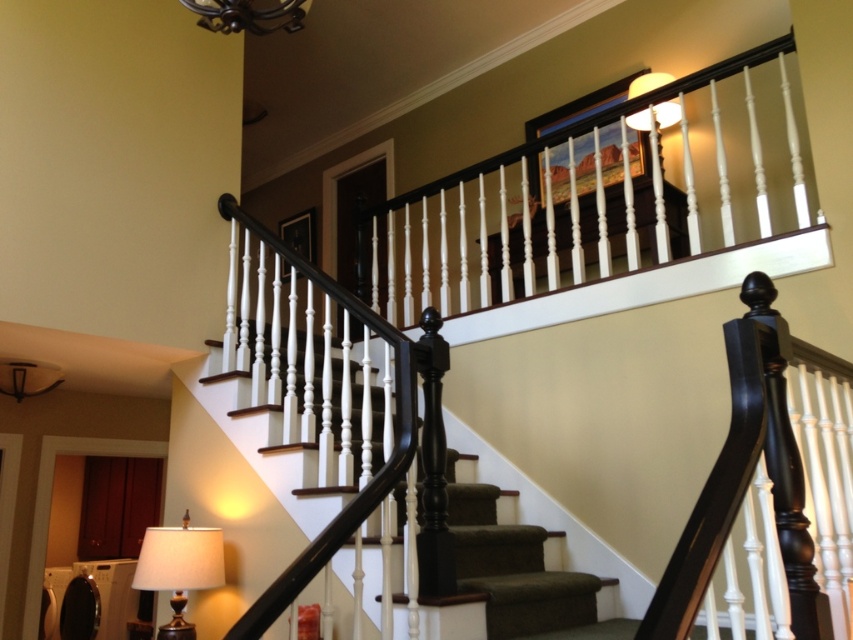
Question: Does gold metallic lamp at lower left have a greater width compared to metallic chandelier at upper center?

Choices:
 (A) no
 (B) yes

Answer: (B)

Question: From the image, what is the correct spatial relationship of matte white lampshade at upper left in relation to matte white lampshade at upper center?

Choices:
 (A) right
 (B) left

Answer: (B)

Question: Which object appears farthest from the camera in this image?

Choices:
 (A) matte white lampshade at upper center
 (B) matte white lampshade at upper left
 (C) black matte stair rail at upper center

Answer: (B)

Question: Which of the following is the farthest from the observer?

Choices:
 (A) metallic chandelier at upper center
 (B) gold metallic lamp at lower left
 (C) black matte stair rail at upper center
 (D) matte white lampshade at upper center

Answer: (D)

Question: Among these points, which one is nearest to the camera?

Choices:
 (A) (286, 8)
 (B) (9, 362)

Answer: (A)

Question: Can you confirm if gold metallic lamp at lower left is positioned below matte white lampshade at upper left?

Choices:
 (A) no
 (B) yes

Answer: (B)